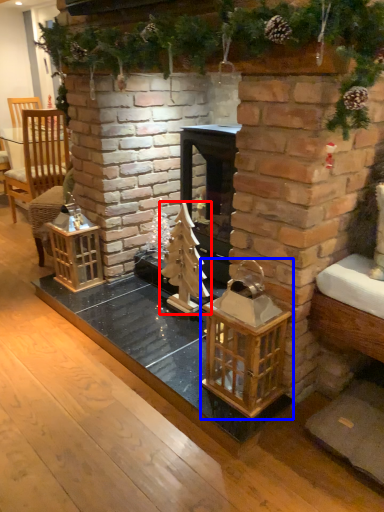
Question: Which point is further to the camera, christmas tree (highlighted by a red box) or cage (highlighted by a blue box)?

Choices:
 (A) christmas tree
 (B) cage

Answer: (A)